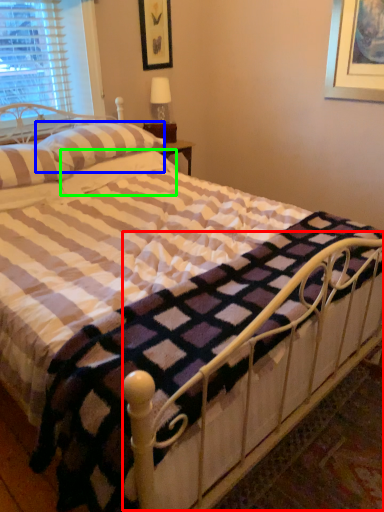
Question: Which is farther away from balustrade (highlighted by a red box)? pillow (highlighted by a blue box) or pillow (highlighted by a green box)?

Choices:
 (A) pillow
 (B) pillow

Answer: (A)